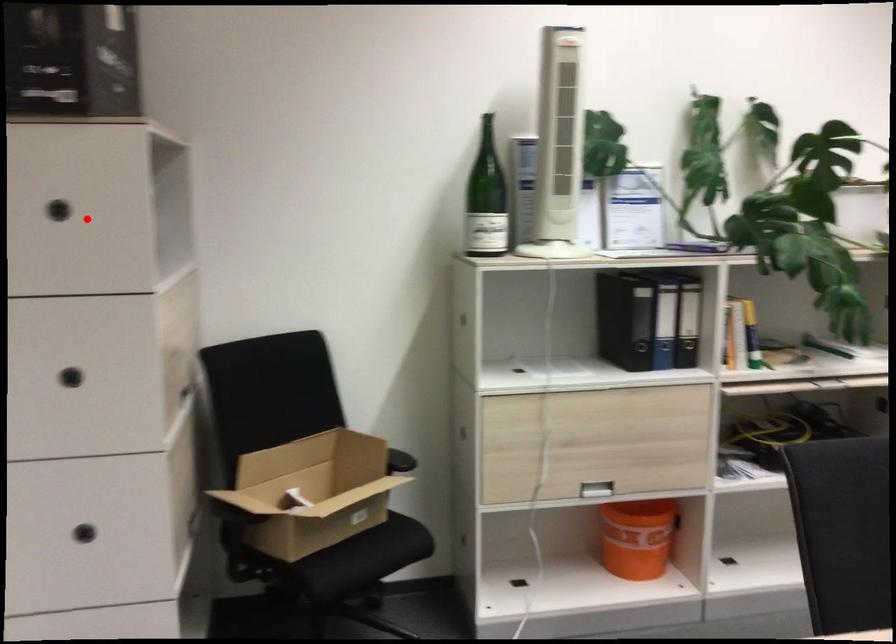
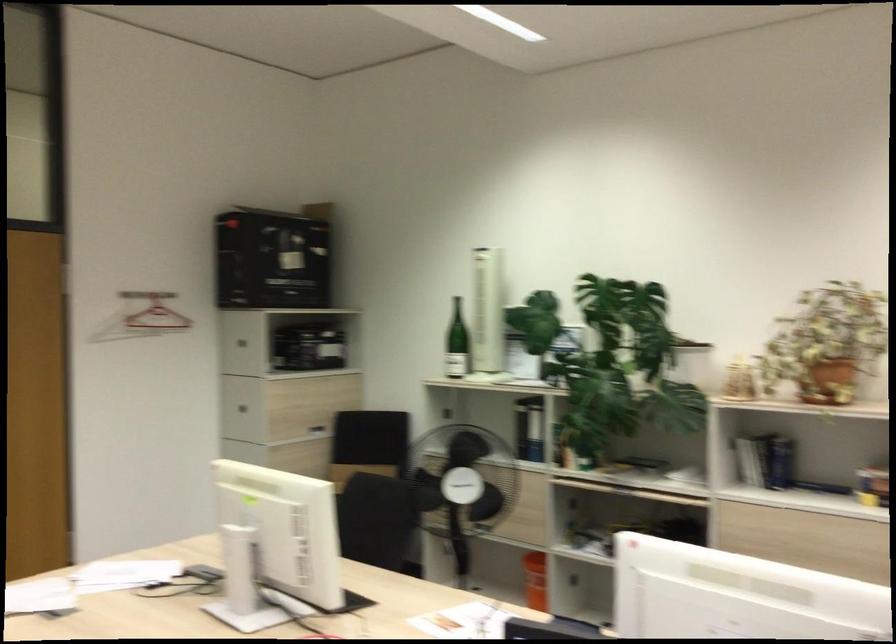
Locate, in the second image, the point that corresponds to the highlighted location in the first image.

(237, 341)